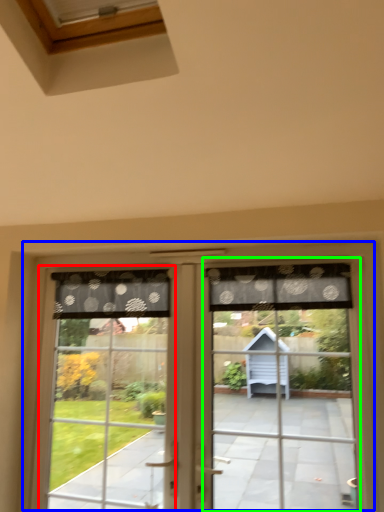
Question: Which is farther away from bay window (highlighted by a red box)? window (highlighted by a blue box) or screen door (highlighted by a green box)?

Choices:
 (A) window
 (B) screen door

Answer: (B)